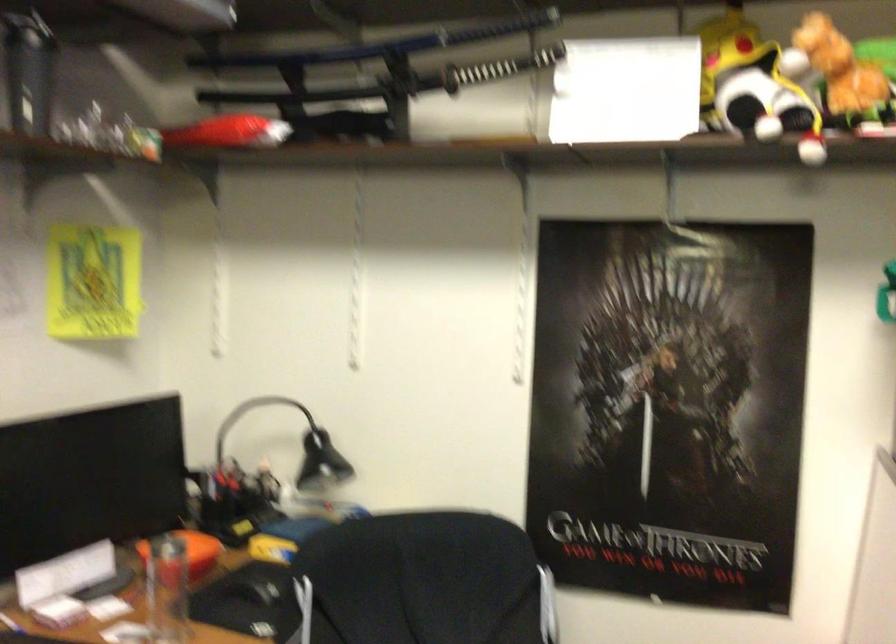
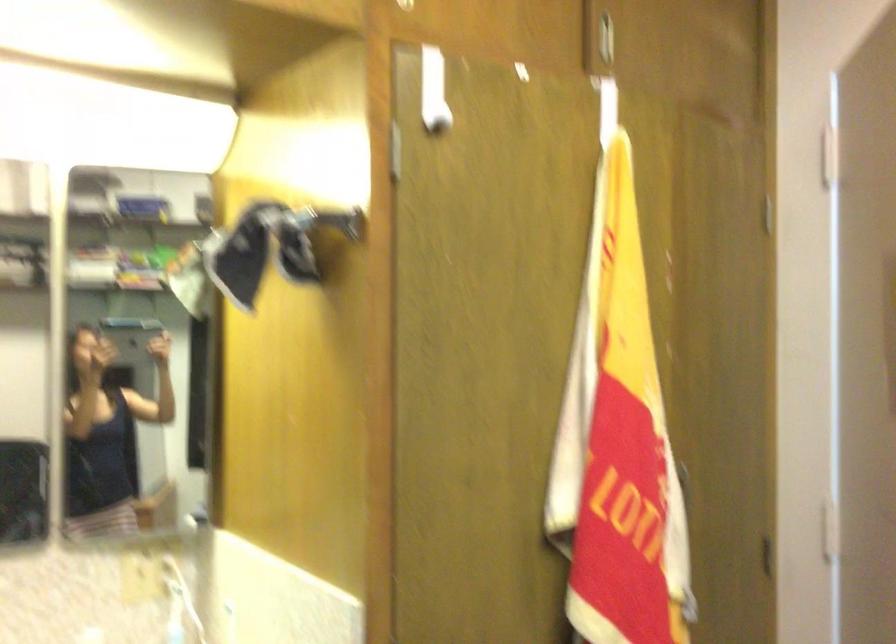
Question: Based on the continuous images, in which direction is the camera rotating? Reply with the corresponding letter.

Choices:
 (A) Left
 (B) Right
 (C) Up
 (D) Down

Answer: (A)